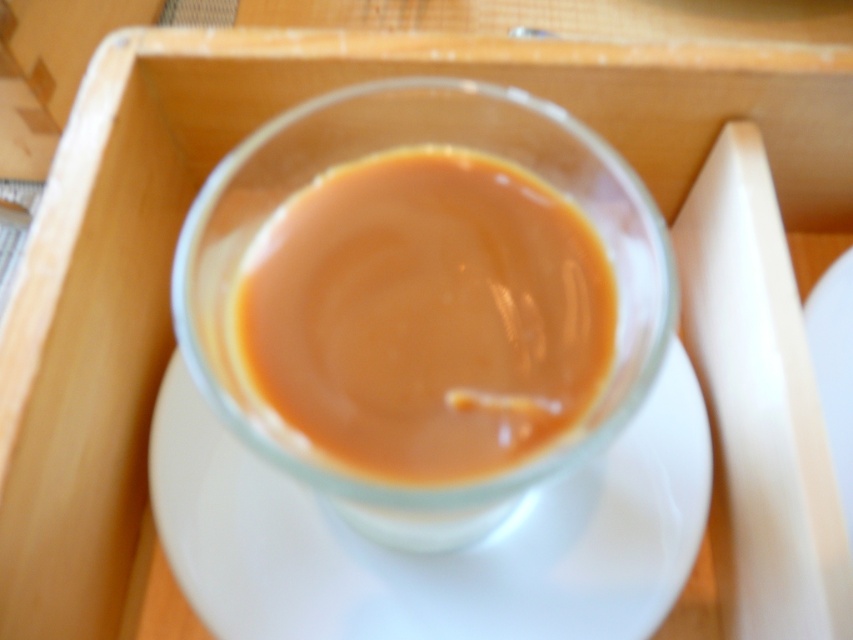
How far apart are translucent glass cup at center and white ceramic saucer at center?

5.44 inches

Does translucent glass cup at center come behind white ceramic saucer at center?

No, translucent glass cup at center is closer to the viewer.

Which is behind, point (242, 326) or point (643, 556)?

The point (643, 556) is behind.

At what (x,y) coordinates should I click in order to perform the action: click on translucent glass cup at center. Please return your answer as a coordinate pair (x, y). The image size is (853, 640). Looking at the image, I should click on (427, 316).